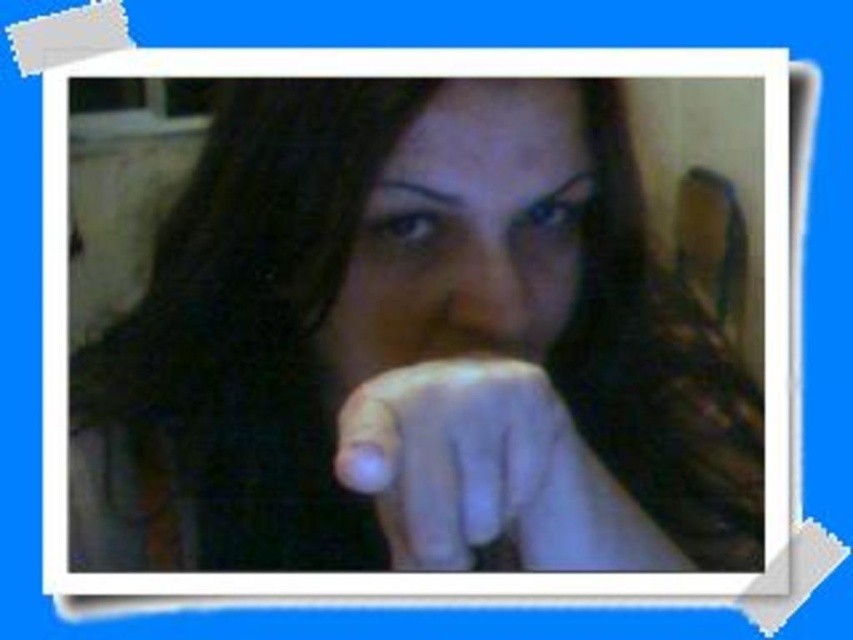
Question: Estimate the real-world distances between objects in this image. Which object is closer to the smooth skin face at center?

Choices:
 (A) white matte hand at center
 (B) matte black hand at center

Answer: (A)

Question: Is the position of matte black hand at center less distant than that of smooth skin face at center?

Choices:
 (A) no
 (B) yes

Answer: (B)

Question: Considering the relative positions of matte black hand at center and smooth skin face at center in the image provided, where is matte black hand at center located with respect to smooth skin face at center?

Choices:
 (A) above
 (B) below

Answer: (B)

Question: Which of the following is the farthest from the observer?

Choices:
 (A) matte black hand at center
 (B) white matte hand at center
 (C) smooth skin face at center

Answer: (C)

Question: Does matte black hand at center have a smaller size compared to smooth skin face at center?

Choices:
 (A) yes
 (B) no

Answer: (B)

Question: Which point is farther to the camera?

Choices:
 (A) (474, 298)
 (B) (357, 394)

Answer: (A)